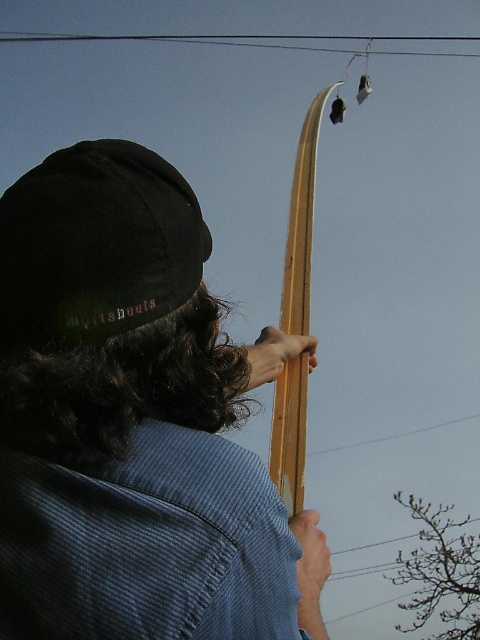
Question: Considering the relative positions of black cotton baseball hat at upper left and wooden pole at center in the image provided, where is black cotton baseball hat at upper left located with respect to wooden pole at center?

Choices:
 (A) right
 (B) left

Answer: (B)

Question: Is wooden bow at upper center smaller than wooden pole at center?

Choices:
 (A) no
 (B) yes

Answer: (B)

Question: Among these points, which one is nearest to the camera?

Choices:
 (A) (115, 38)
 (B) (186, 234)
 (C) (199, 276)
 (D) (288, 243)

Answer: (B)

Question: Can you confirm if wooden bow at upper center is positioned to the right of black cotton baseball hat at upper left?

Choices:
 (A) no
 (B) yes

Answer: (B)

Question: Estimate the real-world distances between objects in this image. Which object is closer to the black wire at upper center?

Choices:
 (A) wooden pole at center
 (B) black cotton baseball hat at upper left

Answer: (A)

Question: Which point appears closest to the camera in this image?

Choices:
 (A) (27, 332)
 (B) (288, 442)
 (C) (321, 51)
 (D) (41, 164)

Answer: (A)